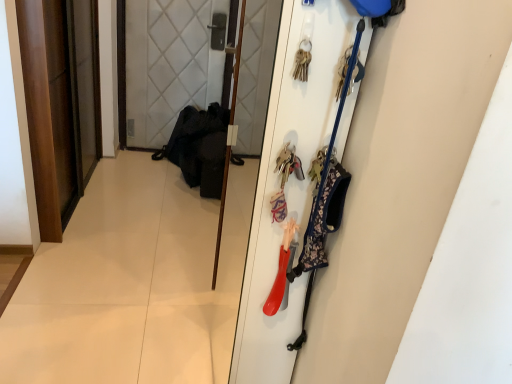
At what (x,y) coordinates should I click in order to perform the action: click on vacant area that lies between wooden door at left, acting as the 2th door starting from the front, and wooden screen door at center. Please return your answer as a coordinate pair (x, y). The height and width of the screenshot is (384, 512). Looking at the image, I should click on (147, 219).